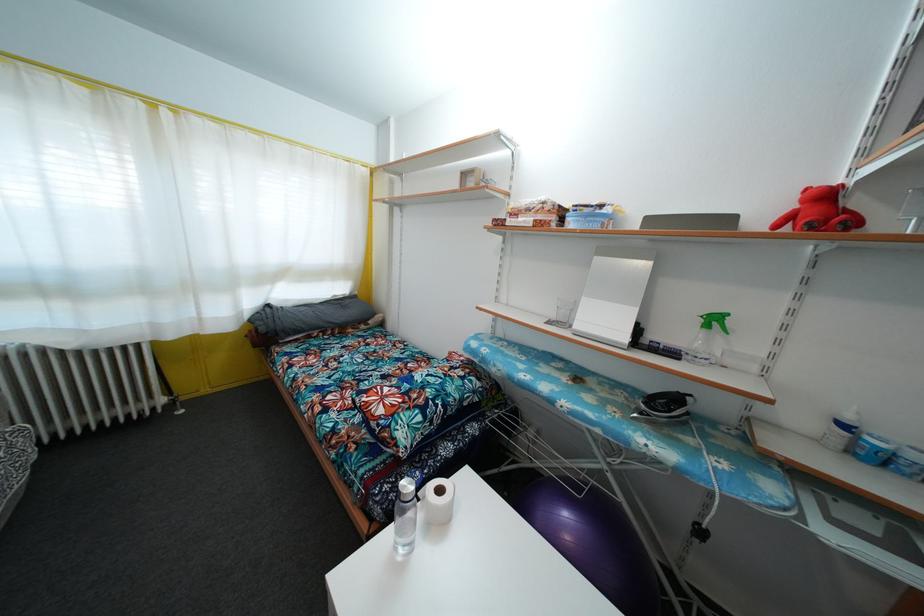
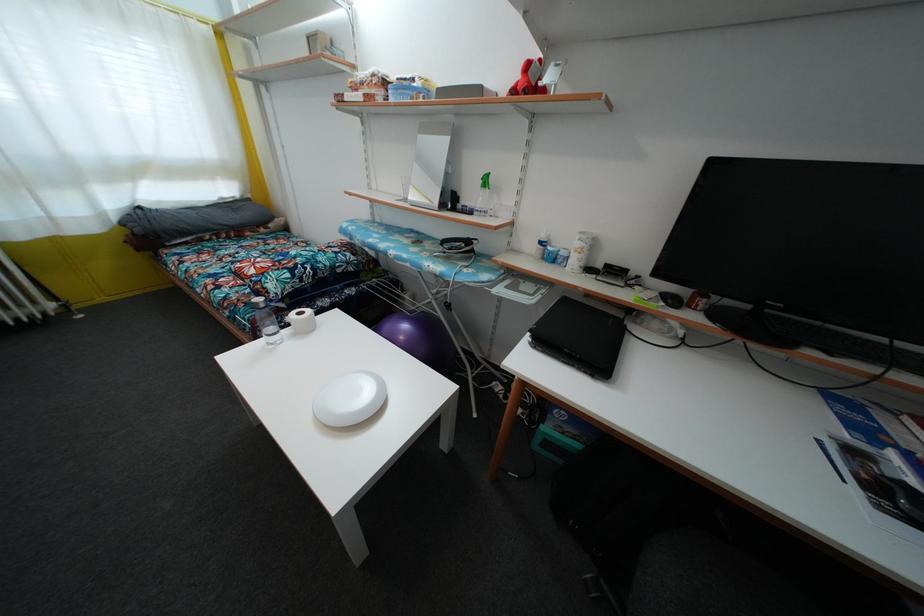
In the second image, find the point that corresponds to point (410, 492) in the first image.

(263, 307)